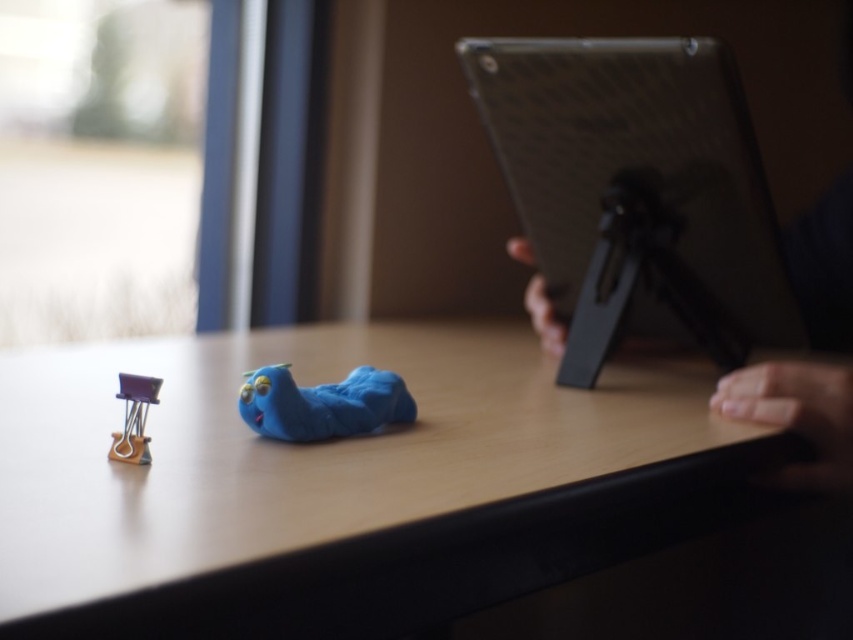
Does matte plastic table at center have a larger size compared to purple plastic clip at lower left?

Indeed, matte plastic table at center has a larger size compared to purple plastic clip at lower left.

Who is lower down, matte plastic table at center or purple plastic clip at lower left?

matte plastic table at center

Where is `matte plastic table at center`? This screenshot has height=640, width=853. matte plastic table at center is located at coordinates (341, 484).

Who is lower down, matte plastic toy at center or purple plastic clip at lower left?

purple plastic clip at lower left is below.

Locate an element on the screen. The height and width of the screenshot is (640, 853). matte plastic toy at center is located at coordinates (322, 403).

Is matte plastic table at center bigger than matte black tablet at right?

Correct, matte plastic table at center is larger in size than matte black tablet at right.

Who is taller, matte plastic table at center or matte black tablet at right?

matte black tablet at right

Which is behind, point (469, 520) or point (595, 115)?

Point (595, 115)

Identify the location of matte plastic table at center. (341, 484).